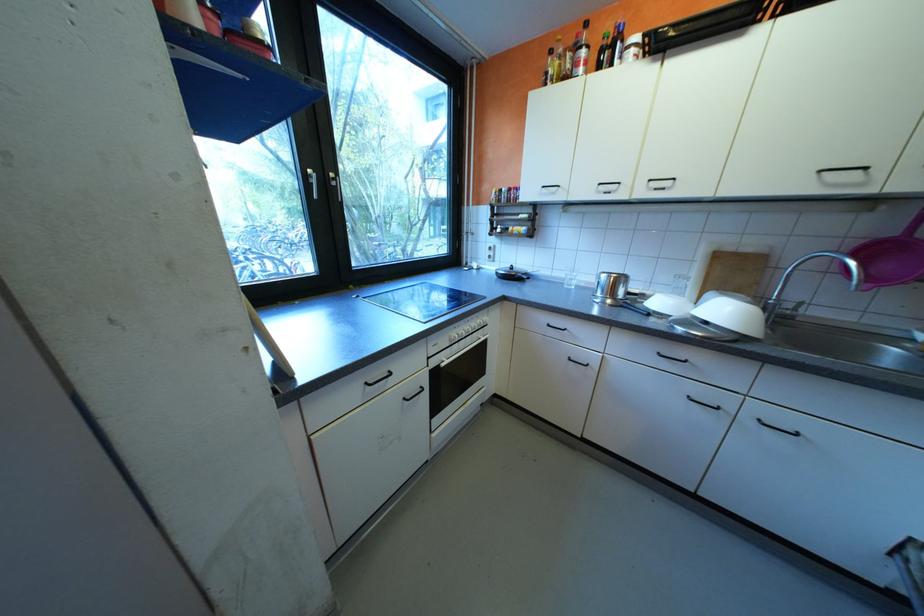
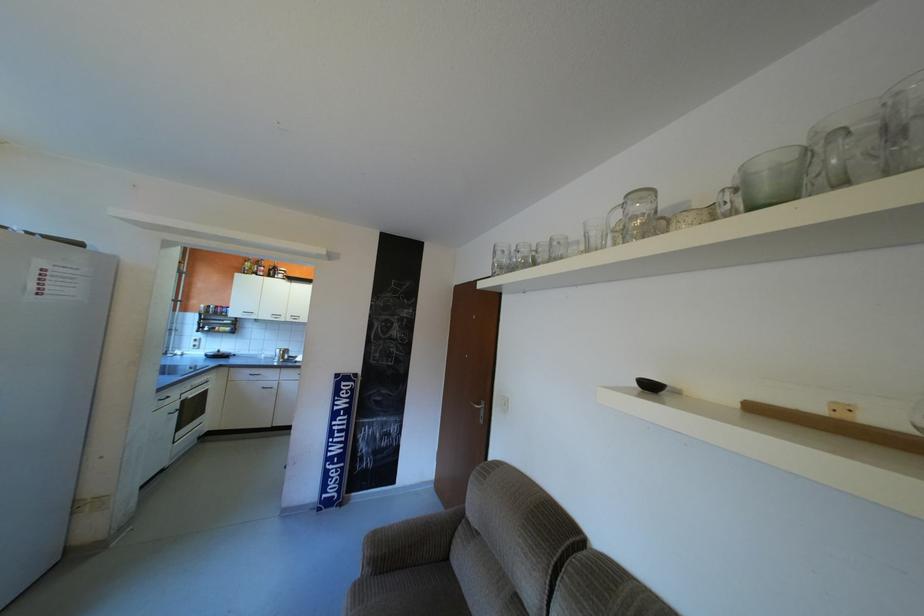
The point at (540,192) is marked in the first image. Where is the corresponding point in the second image?

(246, 312)